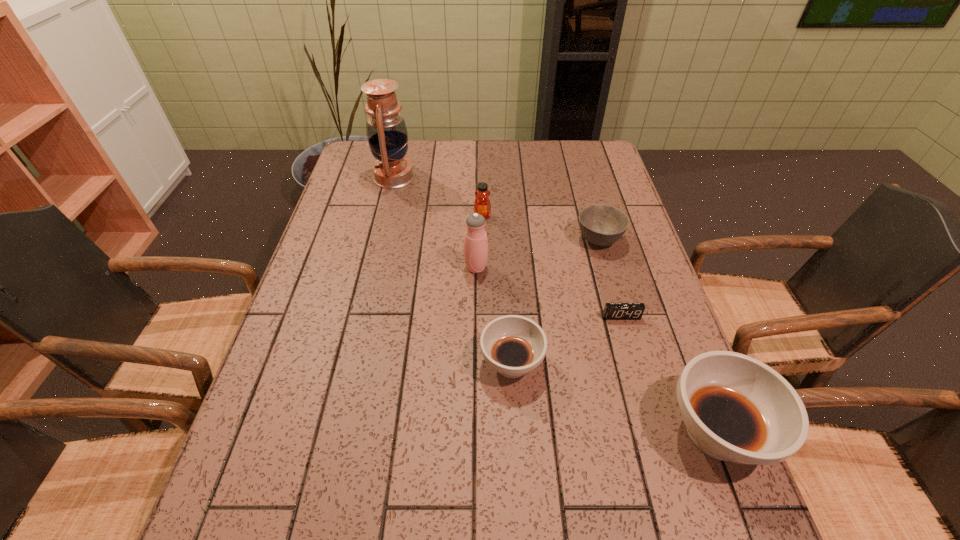
You are a GUI agent. You are given a task and a screenshot of the screen. Output one action in this format:
    pyautogui.click(x=<x>, y=<y>)
    Task: Click on the free location at the near left corner
    This screenshot has height=540, width=960.
    Given the screenshot: What is the action you would take?
    pyautogui.click(x=227, y=477)

The height and width of the screenshot is (540, 960). What are the coordinates of `vacant space at the far right corner of the desktop` in the screenshot? It's located at (590, 162).

In the image, there is a desktop. At what (x,y) coordinates should I click in order to perform the action: click on vacant area at the near right corner. Please return your answer as a coordinate pair (x, y). This screenshot has height=540, width=960. Looking at the image, I should click on (669, 484).

Where is `empty space that is in between the third nearest object and the third farthest object`? The width and height of the screenshot is (960, 540). empty space that is in between the third nearest object and the third farthest object is located at coordinates (610, 278).

This screenshot has width=960, height=540. In order to click on vacant space in between the oil lamp and the sixth nearest object in this screenshot , I will do `click(438, 196)`.

Identify the location of free area in between the fourth nearest object and the shorter soup bowl. This screenshot has width=960, height=540. (494, 315).

Identify the location of blank region between the left soup bowl and the sixth shortest object. (494, 315).

Where is `free space between the fourth tallest object and the left soup bowl`? free space between the fourth tallest object and the left soup bowl is located at coordinates (497, 289).

What are the coordinates of `vacant space that's between the alarm clock and the taller soup bowl` in the screenshot? It's located at (669, 374).

Find the location of a particular element. unoccupied position between the fifth farthest object and the third farthest object is located at coordinates (610, 278).